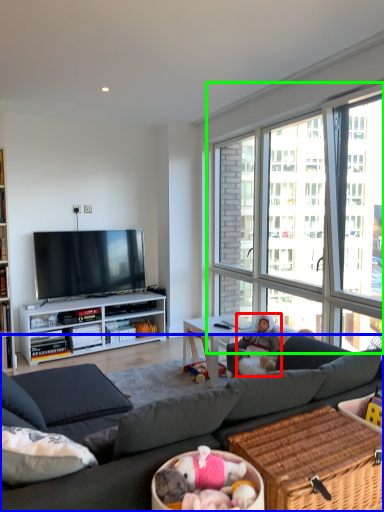
Question: Considering the real-world distances, which object is closest to person (highlighted by a red box)? studio couch (highlighted by a blue box) or window (highlighted by a green box).

Choices:
 (A) studio couch
 (B) window

Answer: (B)